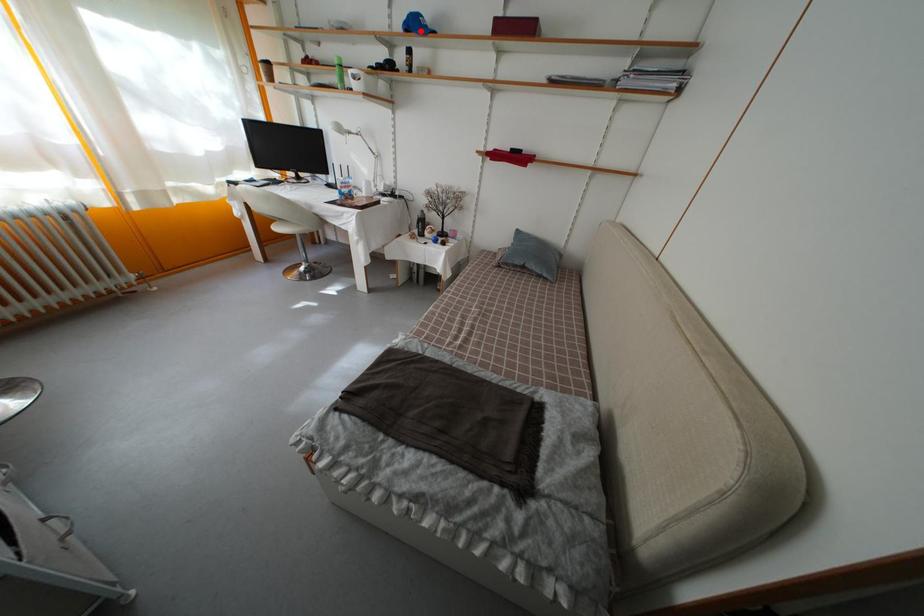
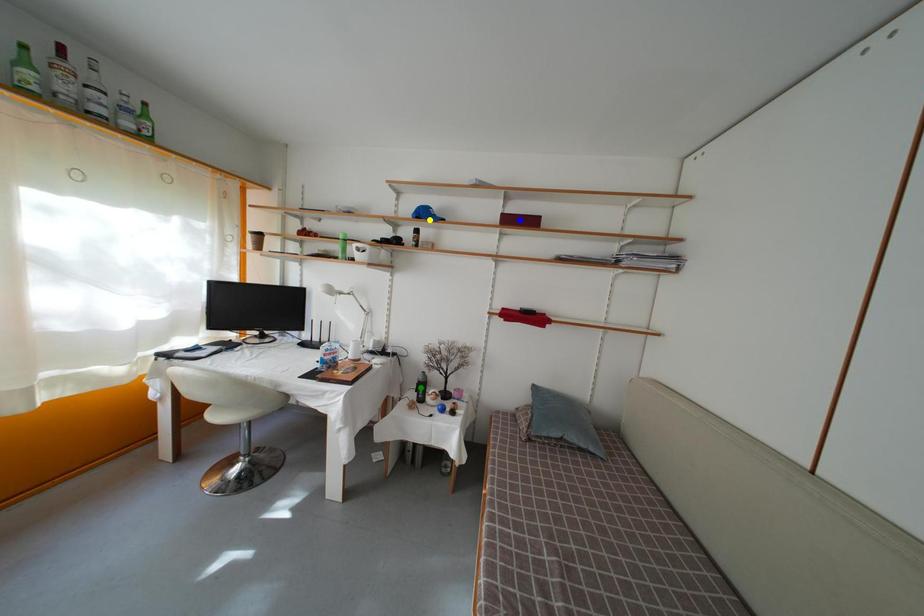
Question: I am providing you with two images of the same scene from different viewpoints. A red point is marked on the first image. You are given multiple points on the second image. In image 2, which mark is for the same physical point as the one in image 1?

Choices:
 (A) green point
 (B) yellow point
 (C) blue point

Answer: (B)